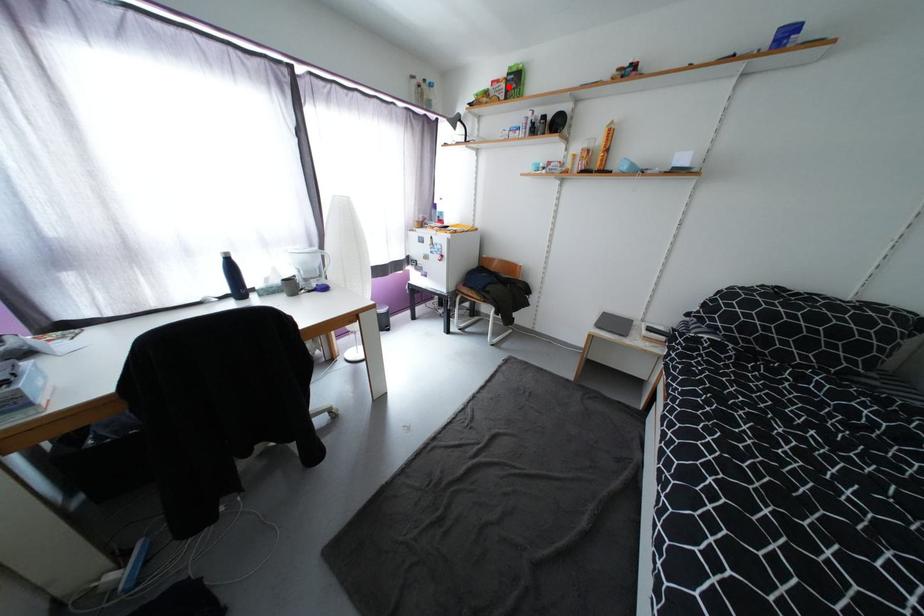
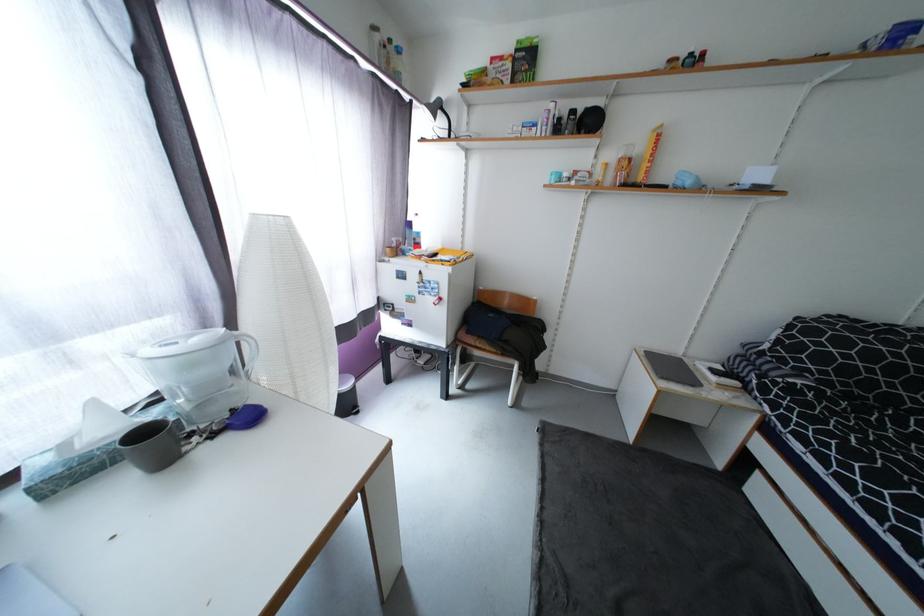
Where in the second image is the point corresponding to the highlighted location from the first image?

(515, 66)